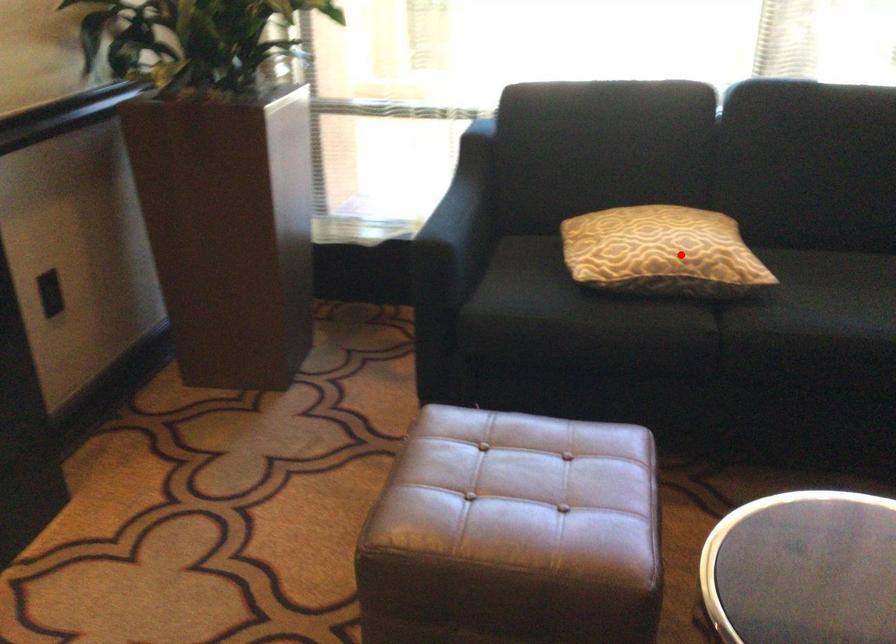
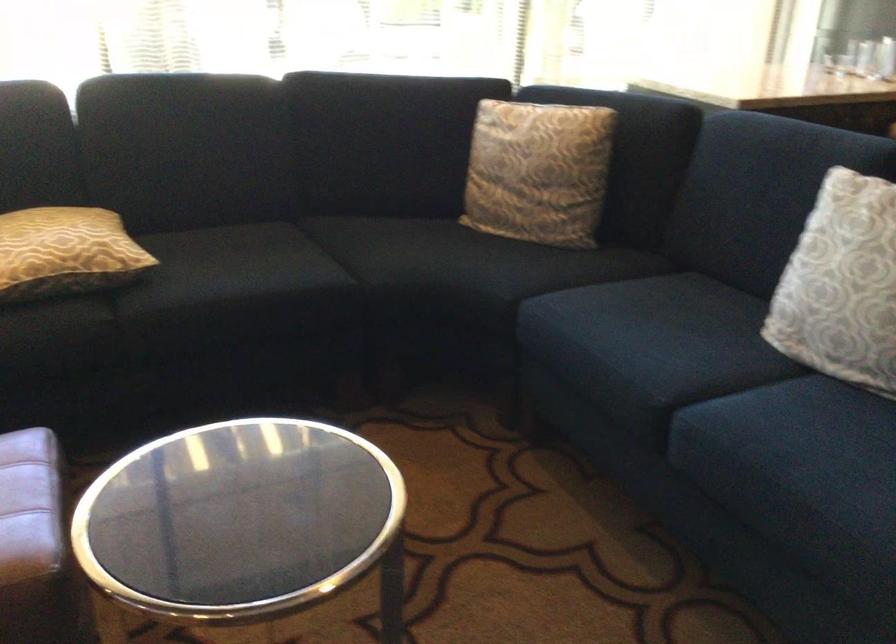
Where in the second image is the point corresponding to the highlighted location from the first image?

(65, 252)